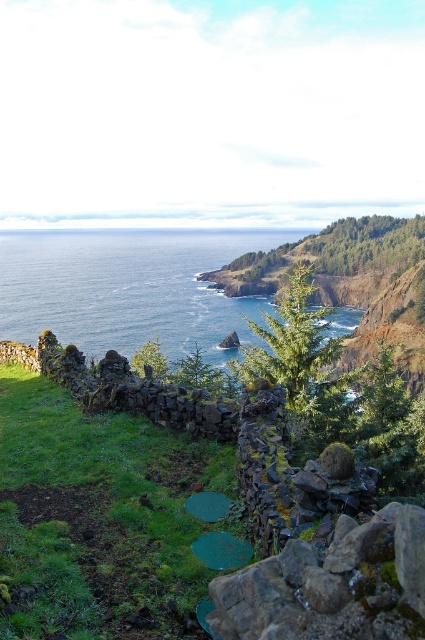
Question: Can you confirm if green grass at lower left is bigger than blue water at center?

Choices:
 (A) yes
 (B) no

Answer: (B)

Question: Which point is closer to the camera?

Choices:
 (A) [266, 308]
 (B) [181, 616]

Answer: (B)

Question: Is green grass at lower left thinner than blue water at center?

Choices:
 (A) no
 (B) yes

Answer: (B)

Question: Is green grass at lower left positioned in front of blue water at center?

Choices:
 (A) yes
 (B) no

Answer: (A)

Question: Which of the following is the closest to the observer?

Choices:
 (A) (155, 492)
 (B) (124, 296)

Answer: (A)